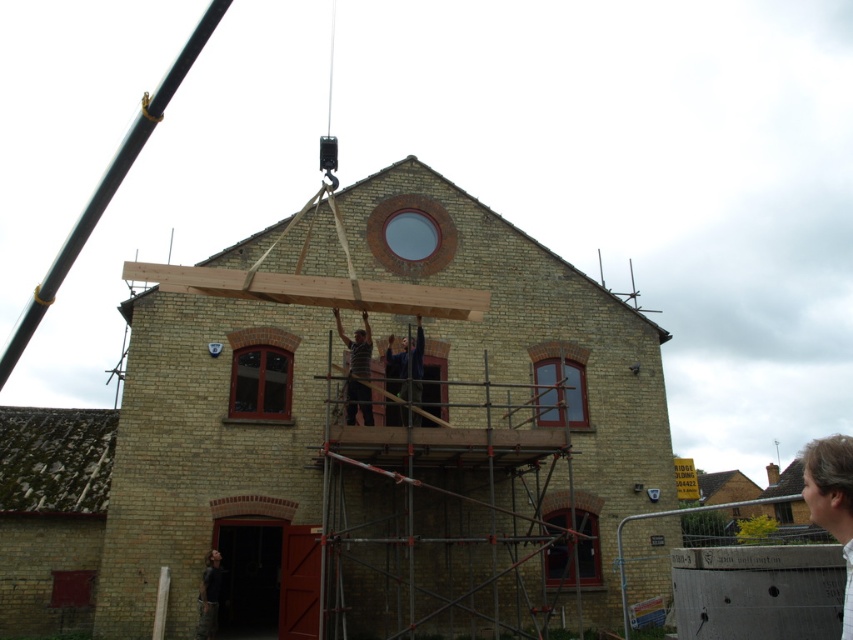
Question: Estimate the real-world distances between objects in this image. Which object is closer to the clear glass window at center?

Choices:
 (A) light brown hair at upper right
 (B) matte wooden window at center
 (C) black metal pole at upper left

Answer: (B)

Question: Among these objects, which one is nearest to the camera?

Choices:
 (A) light brown hair at upper right
 (B) matte brown window at center
 (C) matte glass window at center
 (D) matte wooden window at center

Answer: (A)

Question: Is light brown hair at upper right closer to camera compared to matte glass window at center?

Choices:
 (A) no
 (B) yes

Answer: (B)

Question: Which point is closer to the camera taking this photo?

Choices:
 (A) (144, 108)
 (B) (575, 387)

Answer: (A)

Question: Can you confirm if dark gray shirt at center is thinner than dark blue shirt at center?

Choices:
 (A) yes
 (B) no

Answer: (A)

Question: Does rusty metal roof at lower left appear over wooden beam at center?

Choices:
 (A) yes
 (B) no

Answer: (B)